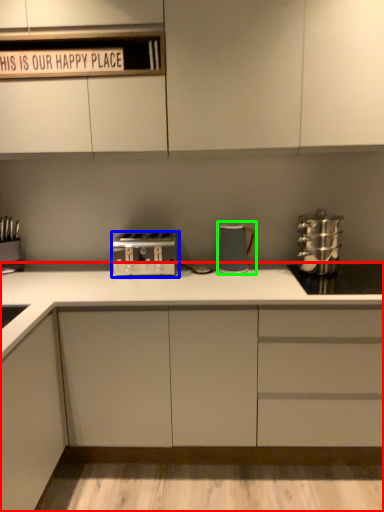
Question: Which object is the closest to the cabinetry (highlighted by a red box)? Choose among these: toaster (highlighted by a blue box) or kitchen appliance (highlighted by a green box).

Choices:
 (A) toaster
 (B) kitchen appliance

Answer: (A)